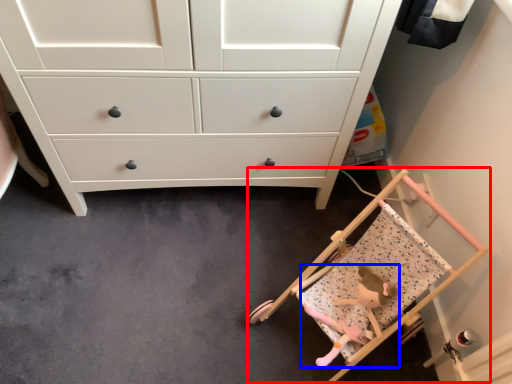
Question: Which object is closer to the camera taking this photo, baby carriage (highlighted by a red box) or toy (highlighted by a blue box)?

Choices:
 (A) baby carriage
 (B) toy

Answer: (A)